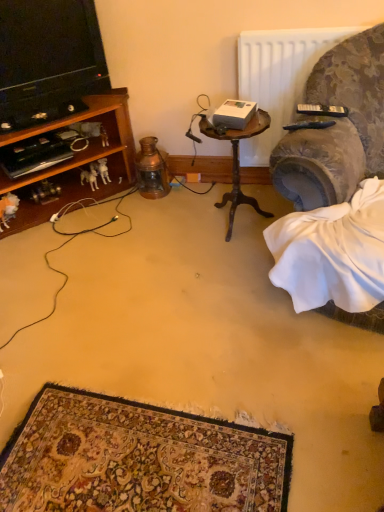
Identify the location of free space that is in between black cable at left and white fabric at lower right. (173, 276).